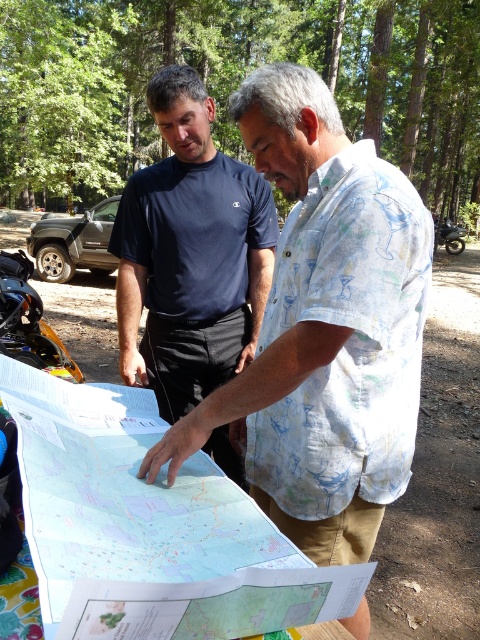
Question: Considering the relative positions of white printed shirt at center and brushed metal motorcycle at center right in the image provided, where is white printed shirt at center located with respect to brushed metal motorcycle at center right?

Choices:
 (A) below
 (B) above

Answer: (A)

Question: Which of the following is the closest to the observer?

Choices:
 (A) light blue paper map at center
 (B) brushed metal motorcycle at center right

Answer: (A)

Question: Which object appears closest to the camera in this image?

Choices:
 (A) white paper map at lower center
 (B) dark blue t-shirt at center

Answer: (A)

Question: Can you confirm if light blue paper map at center is thinner than white paper map at lower center?

Choices:
 (A) no
 (B) yes

Answer: (A)

Question: Is light blue paper map at center closer to camera compared to white paper map at lower center?

Choices:
 (A) yes
 (B) no

Answer: (A)

Question: Based on their relative distances, which object is nearer to the dark blue t-shirt at center?

Choices:
 (A) light blue paper map at center
 (B) white printed shirt at center
 (C) brushed metal motorcycle at center right

Answer: (B)